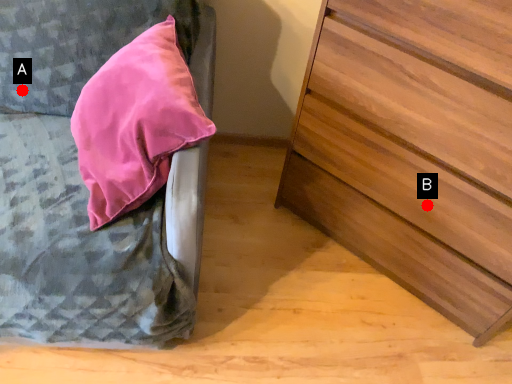
Question: Two points are circled on the image, labeled by A and B beside each circle. Which point is closer to the camera?

Choices:
 (A) A is closer
 (B) B is closer

Answer: (A)